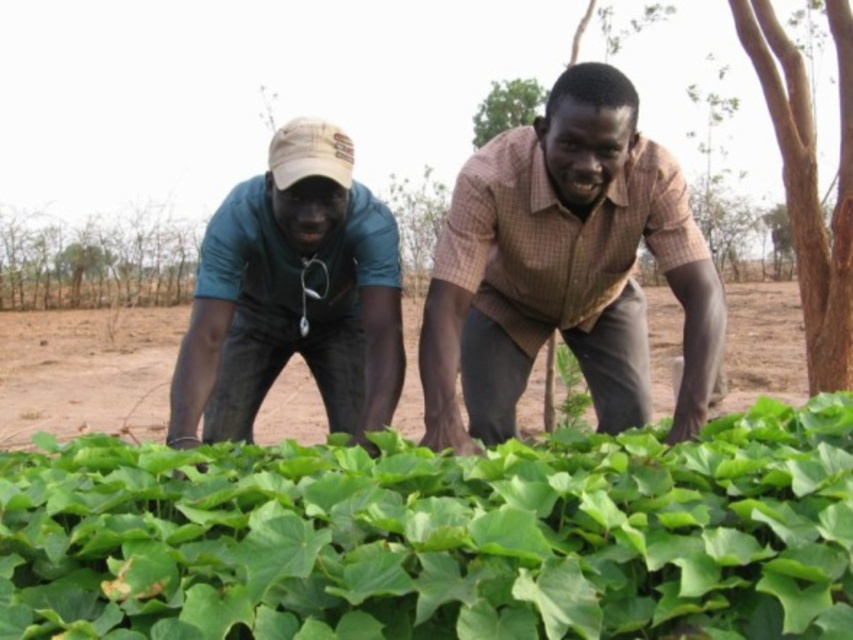
Is green leafy plant at lower center positioned behind brown checkered shirt at center?

No, it is in front of brown checkered shirt at center.

Is green leafy plant at lower center positioned before brown checkered shirt at center?

Yes.

Who is more forward, (329,451) or (628,260)?

Point (329,451)

You are a GUI agent. You are given a task and a screenshot of the screen. Output one action in this format:
    pyautogui.click(x=<x>, y=<y>)
    Task: Click on the green leafy plant at lower center
    The height and width of the screenshot is (640, 853).
    Given the screenshot: What is the action you would take?
    pyautogui.click(x=439, y=536)

Who is lower down, green leafy plant at lower center or matte green shirt at left?

green leafy plant at lower center is lower down.

Can you confirm if green leafy plant at lower center is bigger than matte green shirt at left?

Correct, green leafy plant at lower center is larger in size than matte green shirt at left.

Which is in front, point (598, 563) or point (279, 132)?

Positioned in front is point (598, 563).

This screenshot has height=640, width=853. In order to click on green leafy plant at lower center in this screenshot , I will do `click(439, 536)`.

Which is more to the left, brown checkered shirt at center or matte green shirt at left?

matte green shirt at left

Is brown checkered shirt at center taller than matte green shirt at left?

Yes, brown checkered shirt at center is taller than matte green shirt at left.

Is point (695, 365) positioned after point (300, 353)?

No, (695, 365) is in front of (300, 353).

This screenshot has height=640, width=853. What are the coordinates of `brown checkered shirt at center` in the screenshot? It's located at (563, 268).